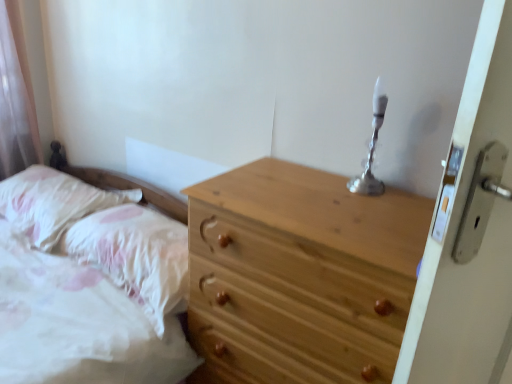
Question: Can you confirm if silver metallic candle holder at upper right is taller than natural wood chest of drawers at center?

Choices:
 (A) no
 (B) yes

Answer: (A)

Question: Does silver metallic candle holder at upper right come behind natural wood chest of drawers at center?

Choices:
 (A) no
 (B) yes

Answer: (B)

Question: Is natural wood chest of drawers at center completely or partially inside silver metallic candle holder at upper right?

Choices:
 (A) yes
 (B) no

Answer: (B)

Question: Does silver metallic candle holder at upper right come in front of natural wood chest of drawers at center?

Choices:
 (A) no
 (B) yes

Answer: (A)

Question: Can we say silver metallic candle holder at upper right lies outside natural wood chest of drawers at center?

Choices:
 (A) yes
 (B) no

Answer: (A)

Question: In terms of size, does natural wood chest of drawers at center appear bigger or smaller than fluffy white pillow at left, the first pillow from the left?

Choices:
 (A) big
 (B) small

Answer: (A)

Question: From the image's perspective, is natural wood chest of drawers at center above or below fluffy white pillow at left, the first pillow from the left?

Choices:
 (A) above
 (B) below

Answer: (B)

Question: Considering the positions of point (327, 327) and point (35, 173), is point (327, 327) closer or farther from the camera than point (35, 173)?

Choices:
 (A) closer
 (B) farther

Answer: (A)

Question: Relative to fluffy white pillow at left, which ranks as the second pillow in right-to-left order, is natural wood chest of drawers at center in front or behind?

Choices:
 (A) front
 (B) behind

Answer: (A)

Question: From a real-world perspective, is white fluffy pillow at lower left, the 1th pillow positioned from the right, physically located above or below natural wood chest of drawers at center?

Choices:
 (A) below
 (B) above

Answer: (B)

Question: Relative to natural wood chest of drawers at center, is white fluffy pillow at lower left, arranged as the 2th pillow when viewed from the left, in front or behind?

Choices:
 (A) behind
 (B) front

Answer: (A)

Question: Considering the positions of white fluffy pillow at lower left, the 1th pillow positioned from the right, and natural wood chest of drawers at center in the image, is white fluffy pillow at lower left, the 1th pillow positioned from the right, wider or thinner than natural wood chest of drawers at center?

Choices:
 (A) thin
 (B) wide

Answer: (A)

Question: From the image's perspective, is white fluffy pillow at lower left, arranged as the 2th pillow when viewed from the left, located above or below natural wood chest of drawers at center?

Choices:
 (A) above
 (B) below

Answer: (A)

Question: Considering the positions of natural wood chest of drawers at center and white fluffy pillow at lower left, arranged as the 2th pillow when viewed from the left, in the image, is natural wood chest of drawers at center bigger or smaller than white fluffy pillow at lower left, arranged as the 2th pillow when viewed from the left,?

Choices:
 (A) small
 (B) big

Answer: (B)

Question: From a real-world perspective, is natural wood chest of drawers at center above or below white fluffy pillow at lower left, the 1th pillow positioned from the right?

Choices:
 (A) below
 (B) above

Answer: (A)